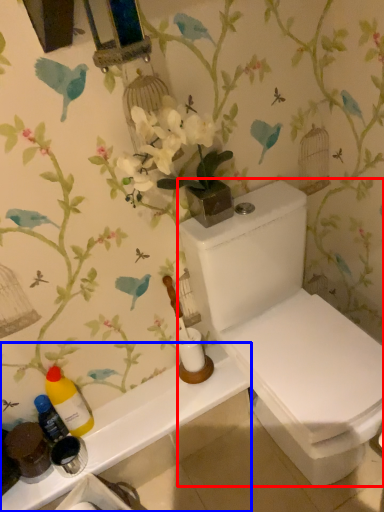
Question: Which object appears farthest to the camera in this image, toilet (highlighted by a red box) or counter top (highlighted by a blue box)?

Choices:
 (A) toilet
 (B) counter top

Answer: (B)